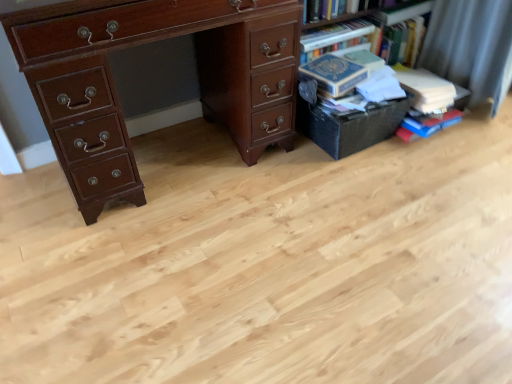
Question: Is the position of hardcover book at right, positioned as the first book in left-to-right order, less distant than that of hardcover books at upper right?

Choices:
 (A) no
 (B) yes

Answer: (B)

Question: Is the depth of hardcover book at right, positioned as the first book in left-to-right order, greater than that of hardcover books at upper right?

Choices:
 (A) yes
 (B) no

Answer: (B)

Question: Considering the relative sizes of hardcover book at right, the 2th book positioned from the right, and hardcover books at upper right in the image provided, is hardcover book at right, the 2th book positioned from the right, wider than hardcover books at upper right?

Choices:
 (A) yes
 (B) no

Answer: (A)

Question: Is hardcover book at right, positioned as the first book in left-to-right order, smaller than hardcover books at upper right?

Choices:
 (A) yes
 (B) no

Answer: (A)

Question: Is hardcover book at right, the 2th book positioned from the right, with hardcover books at upper right?

Choices:
 (A) no
 (B) yes

Answer: (A)

Question: From the image's perspective, relative to black matte box at right, is hardcover book at right, acting as the 1th book starting from the right, above or below?

Choices:
 (A) above
 (B) below

Answer: (A)

Question: Is hardcover book at right, the second book viewed from the left, inside or outside of black matte box at right?

Choices:
 (A) outside
 (B) inside

Answer: (A)

Question: Relative to black matte box at right, is hardcover book at right, acting as the 1th book starting from the right, in front or behind?

Choices:
 (A) behind
 (B) front

Answer: (A)

Question: Is hardcover book at right, acting as the 1th book starting from the right, bigger or smaller than black matte box at right?

Choices:
 (A) big
 (B) small

Answer: (B)

Question: From their relative heights in the image, would you say black matte box at right is taller or shorter than hardcover books at upper right?

Choices:
 (A) tall
 (B) short

Answer: (B)

Question: From a real-world perspective, is black matte box at right positioned above or below hardcover books at upper right?

Choices:
 (A) below
 (B) above

Answer: (A)

Question: In the image, is black matte box at right positioned in front of or behind hardcover books at upper right?

Choices:
 (A) behind
 (B) front

Answer: (B)

Question: In terms of width, does black matte box at right look wider or thinner when compared to hardcover books at upper right?

Choices:
 (A) thin
 (B) wide

Answer: (A)

Question: Is hardcover books at upper right in front of or behind hardcover book at right, acting as the 1th book starting from the right, in the image?

Choices:
 (A) front
 (B) behind

Answer: (B)

Question: From a real-world perspective, is hardcover books at upper right physically located above or below hardcover book at right, acting as the 1th book starting from the right?

Choices:
 (A) below
 (B) above

Answer: (B)